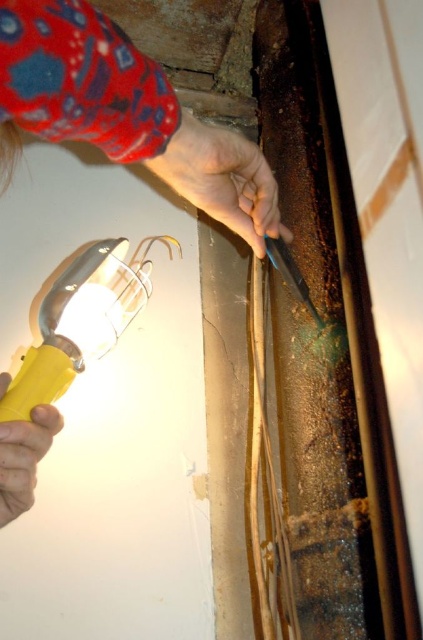
Is smooth skin hand at upper center positioned at the back of yellow plastic flashlight at lower left?

That is True.

Is smooth skin hand at upper center in front of yellow plastic flashlight at lower left?

No.

Where is `smooth skin hand at upper center`? The width and height of the screenshot is (423, 640). smooth skin hand at upper center is located at coordinates (222, 179).

Measure the distance between matte fabric hand at upper center and camera.

A distance of 34.52 centimeters exists between matte fabric hand at upper center and camera.

Is matte fabric hand at upper center to the left of smooth skin hand at upper center from the viewer's perspective?

Yes, matte fabric hand at upper center is to the left of smooth skin hand at upper center.

Between point (211, 198) and point (200, 147), which one is positioned behind?

Point (211, 198)

The image size is (423, 640). Identify the location of matte fabric hand at upper center. (126, 112).

Between matte fabric hand at upper center and yellow plastic flashlight at lower left, which one has less height?

yellow plastic flashlight at lower left

Between point (132, 113) and point (2, 468), which one is positioned behind?

The point (2, 468) is behind.

Where is `matte fabric hand at upper center`? matte fabric hand at upper center is located at coordinates (126, 112).